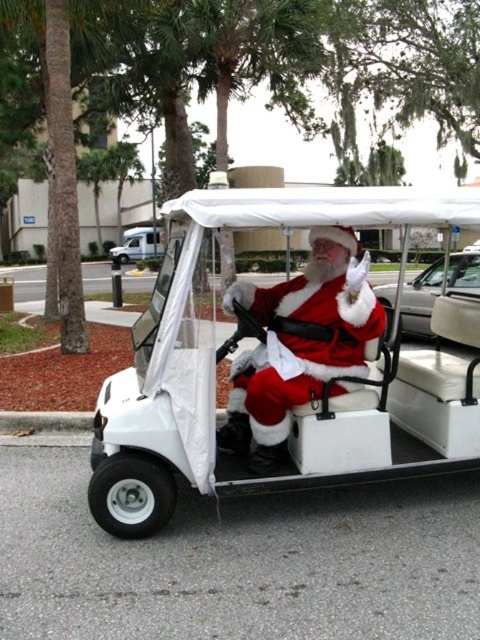
You are standing in the parking lot where Santa is sitting in the golf cart. You need to locate the white leather car at right. According to the coordinates provided, where exactly should you look to find it?

The white leather car at right is located at coordinates point (420, 300).

You are a delivery driver who needs to park your white glossy van at upper left near the white matte golf cart at center. Based on their positions in the image, can you determine which side of the golf cart you should park on?

The white matte golf cart at center is to the right of the white glossy van at upper left, so you should park the white glossy van at upper left to the left side of the white matte golf cart at center.

You are a photographer trying to capture a photo of the fuzzy red santa at center and the white leather car at right. From which side should you position yourself to ensure both subjects are fully visible in the frame?

You should position yourself to the left of the fuzzy red santa at center and white leather car at right to ensure both are fully visible since the fuzzy red santa at center is to the left of the white leather car at right.